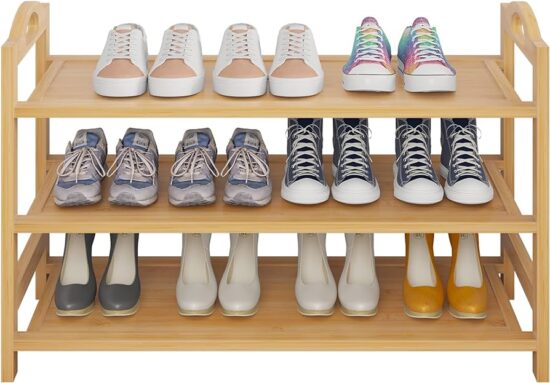
Where is `shoes on the bottom shelf`? shoes on the bottom shelf is located at coordinates (74, 299), (117, 292), (190, 295), (224, 294), (320, 291), (361, 287), (438, 288), (469, 296).